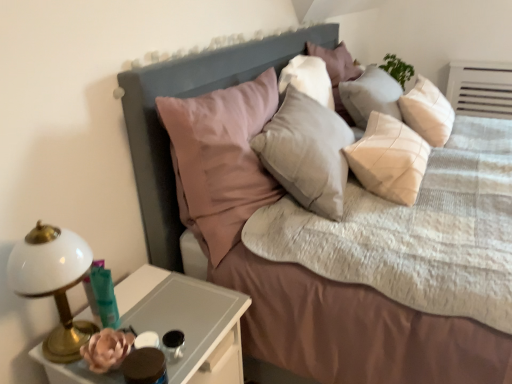
Question: Is the surface of black glass candle holder at lower left, arranged as the second candle holder when viewed from the left, in direct contact with white glossy bedside lamp at left?

Choices:
 (A) yes
 (B) no

Answer: (B)

Question: Does black glass candle holder at lower left, arranged as the second candle holder when viewed from the left, contain white glossy bedside lamp at left?

Choices:
 (A) no
 (B) yes

Answer: (A)

Question: From the image's perspective, is black glass candle holder at lower left, arranged as the 1th candle holder when viewed from the right, on white glossy bedside lamp at left?

Choices:
 (A) no
 (B) yes

Answer: (A)

Question: Is black glass candle holder at lower left, arranged as the second candle holder when viewed from the left, wider than white glossy bedside lamp at left?

Choices:
 (A) yes
 (B) no

Answer: (B)

Question: Is black glass candle holder at lower left, arranged as the 1th candle holder when viewed from the right, bigger than white glossy bedside lamp at left?

Choices:
 (A) yes
 (B) no

Answer: (B)

Question: Is point (173, 309) positioned closer to the camera than point (101, 276)?

Choices:
 (A) closer
 (B) farther

Answer: (B)

Question: Relative to translucent glass candle holder at lower left, the 2th candle holder when ordered from right to left, is white glossy nightstand at lower left in front or behind?

Choices:
 (A) behind
 (B) front

Answer: (B)

Question: From a real-world perspective, is white glossy nightstand at lower left positioned above or below translucent glass candle holder at lower left, positioned as the 1th candle holder in left-to-right order?

Choices:
 (A) above
 (B) below

Answer: (B)

Question: From the image's perspective, is white glossy nightstand at lower left above or below translucent glass candle holder at lower left, positioned as the 1th candle holder in left-to-right order?

Choices:
 (A) below
 (B) above

Answer: (A)

Question: Is translucent glass candle holder at lower left, the 2th candle holder when ordered from right to left, inside or outside of black glass candle holder at lower left, arranged as the 1th candle holder when viewed from the right?

Choices:
 (A) inside
 (B) outside

Answer: (B)

Question: Is translucent glass candle holder at lower left, the 2th candle holder when ordered from right to left, taller or shorter than black glass candle holder at lower left, arranged as the 1th candle holder when viewed from the right?

Choices:
 (A) short
 (B) tall

Answer: (B)

Question: From the image's perspective, is translucent glass candle holder at lower left, the 2th candle holder when ordered from right to left, above or below black glass candle holder at lower left, arranged as the second candle holder when viewed from the left?

Choices:
 (A) below
 (B) above

Answer: (B)

Question: In terms of size, does translucent glass candle holder at lower left, the 2th candle holder when ordered from right to left, appear bigger or smaller than black glass candle holder at lower left, arranged as the 1th candle holder when viewed from the right?

Choices:
 (A) big
 (B) small

Answer: (A)

Question: Looking at the image, does textured beige bed at center seem bigger or smaller compared to translucent glass candle holder at lower left, positioned as the 1th candle holder in left-to-right order?

Choices:
 (A) big
 (B) small

Answer: (A)

Question: From a real-world perspective, is textured beige bed at center above or below translucent glass candle holder at lower left, the 2th candle holder when ordered from right to left?

Choices:
 (A) above
 (B) below

Answer: (B)